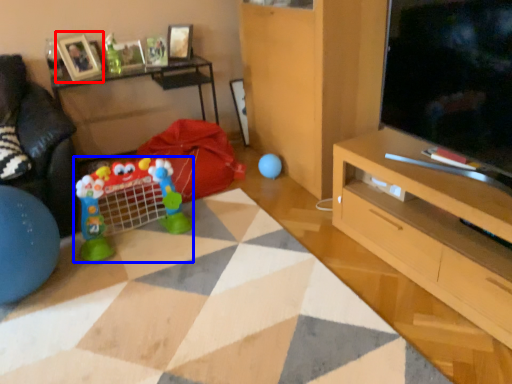
Question: Which of the following is the farthest to the observer, picture frame (highlighted by a red box) or toy (highlighted by a blue box)?

Choices:
 (A) picture frame
 (B) toy

Answer: (A)